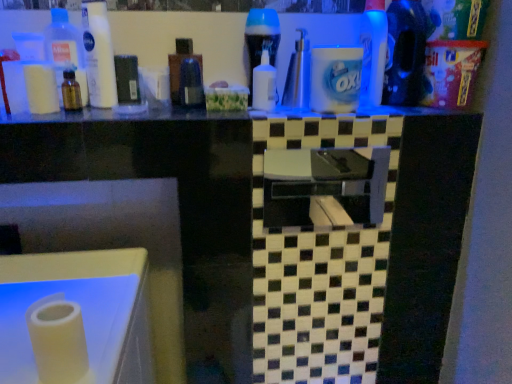
Question: Is white matte toilet paper at left far away from white matte paper towel at lower left?

Choices:
 (A) yes
 (B) no

Answer: (B)

Question: Is white matte toilet paper at left behind white matte paper towel at lower left?

Choices:
 (A) no
 (B) yes

Answer: (B)

Question: Does white matte toilet paper at left have a smaller size compared to white matte paper towel at lower left?

Choices:
 (A) no
 (B) yes

Answer: (B)

Question: From a real-world perspective, does white matte toilet paper at left sit lower than white matte paper towel at lower left?

Choices:
 (A) yes
 (B) no

Answer: (B)

Question: Can you confirm if white matte toilet paper at left is positioned to the left of white matte paper towel at lower left?

Choices:
 (A) no
 (B) yes

Answer: (B)

Question: Is black glossy counter top at upper center bigger or smaller than white matte toilet paper at left?

Choices:
 (A) big
 (B) small

Answer: (A)

Question: In terms of height, does black glossy counter top at upper center look taller or shorter compared to white matte toilet paper at left?

Choices:
 (A) tall
 (B) short

Answer: (B)

Question: From the image's perspective, is black glossy counter top at upper center positioned above or below white matte toilet paper at left?

Choices:
 (A) below
 (B) above

Answer: (A)

Question: Is point (61, 112) positioned closer to the camera than point (53, 71)?

Choices:
 (A) closer
 (B) farther

Answer: (A)

Question: Looking at their shapes, would you say white matte toilet paper at left is wider or thinner than black glossy counter top at upper center?

Choices:
 (A) wide
 (B) thin

Answer: (B)

Question: From a real-world perspective, is white matte toilet paper at left physically located above or below black glossy counter top at upper center?

Choices:
 (A) below
 (B) above

Answer: (B)

Question: Is white matte toilet paper at left spatially inside black glossy counter top at upper center, or outside of it?

Choices:
 (A) inside
 (B) outside

Answer: (B)

Question: Is white matte toilet paper at left bigger or smaller than black glossy counter top at upper center?

Choices:
 (A) small
 (B) big

Answer: (A)

Question: From their relative heights in the image, would you say blue glossy bottle at upper right, the first cleaning product from the right, is taller or shorter than blue glossy bottle at center, positioned as the third bottle in right-to-left order?

Choices:
 (A) short
 (B) tall

Answer: (B)

Question: Is blue glossy bottle at upper right, which ranks as the third cleaning product in left-to-right order, spatially inside blue glossy bottle at center, the fourth bottle viewed from the left, or outside of it?

Choices:
 (A) outside
 (B) inside

Answer: (A)